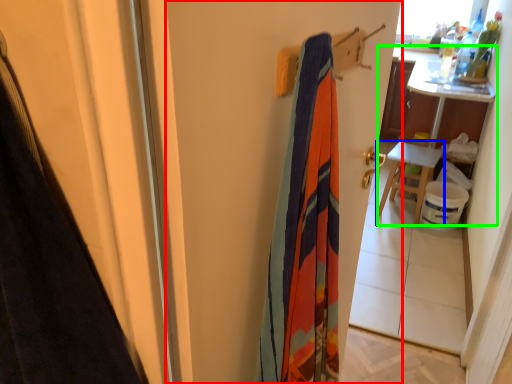
Question: Estimate the real-world distances between objects in this image. Which object is closer to screen door (highlighted by a red box), furniture (highlighted by a blue box) or table (highlighted by a green box)?

Choices:
 (A) furniture
 (B) table

Answer: (A)